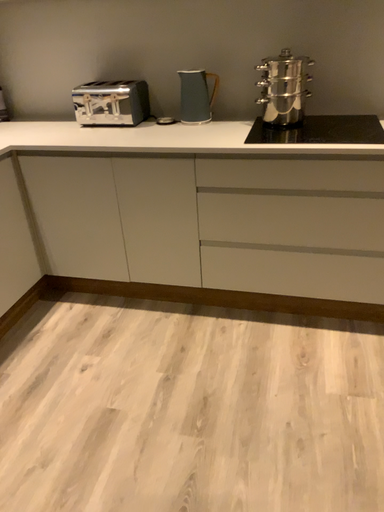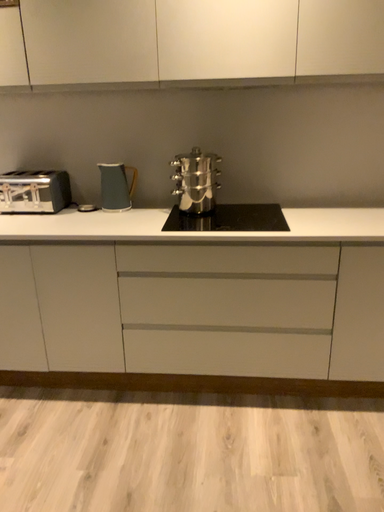
Question: How did the camera likely rotate when shooting the video?

Choices:
 (A) rotated downward
 (B) rotated upward

Answer: (B)